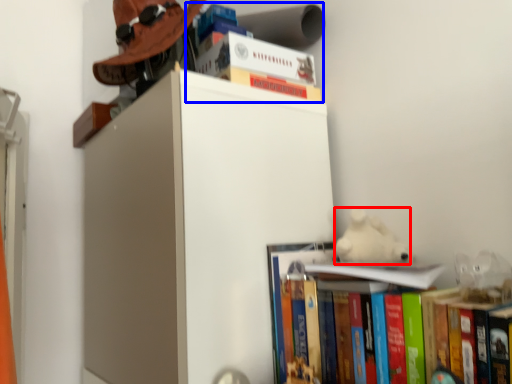
Question: Which object is closer to the camera taking this photo, animal (highlighted by a red box) or book (highlighted by a blue box)?

Choices:
 (A) animal
 (B) book

Answer: (A)